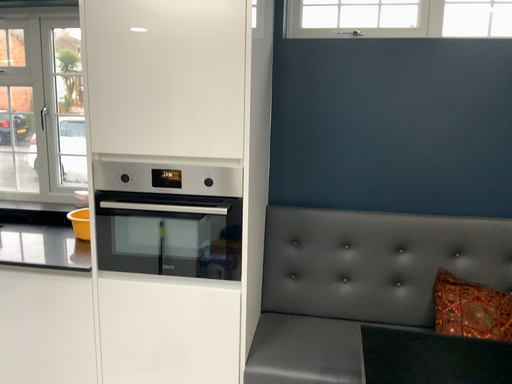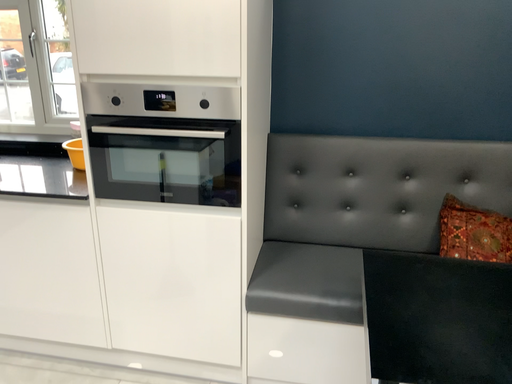
Question: Which way did the camera rotate in the video?

Choices:
 (A) rotated upward
 (B) rotated downward

Answer: (B)